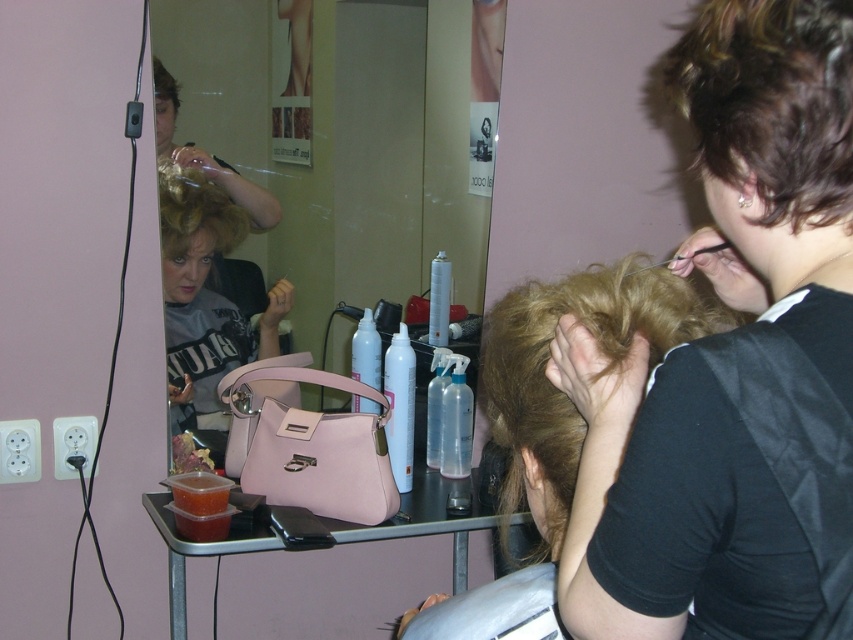
Question: Does blonde silky hair at center have a greater width compared to curly blonde hair at upper center?

Choices:
 (A) yes
 (B) no

Answer: (A)

Question: Which of the following is the closest to the observer?

Choices:
 (A) (160, 88)
 (B) (769, 225)
 (C) (485, 260)
 (D) (769, 481)

Answer: (D)

Question: Which of the following is the farthest from the observer?

Choices:
 (A) (717, 36)
 (B) (839, 576)
 (C) (370, 244)

Answer: (C)

Question: Among these objects, which one is farthest from the camera?

Choices:
 (A) matte pink handbag at center
 (B) blonde silky hair at center

Answer: (A)

Question: Is blonde silky hair at center below matte pink handbag at center?

Choices:
 (A) yes
 (B) no

Answer: (A)

Question: Does dark brown hair at upper right have a greater width compared to pink leather handbag at center?

Choices:
 (A) yes
 (B) no

Answer: (B)